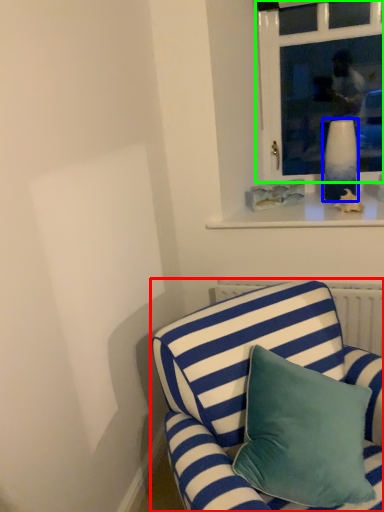
Question: Considering the real-world distances, which object is farthest from studio couch (highlighted by a red box)? vase (highlighted by a blue box) or window (highlighted by a green box)?

Choices:
 (A) vase
 (B) window

Answer: (B)